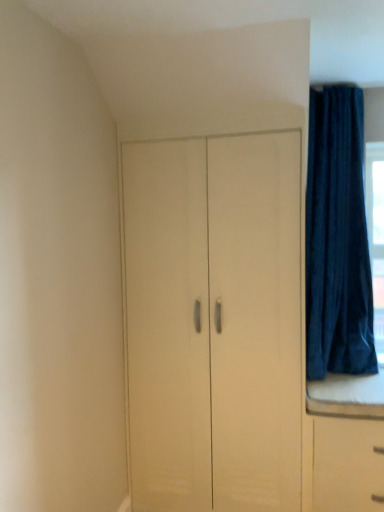
Question: From a real-world perspective, is matte white cupboard at center positioned above or below dark blue velvet curtain at upper right?

Choices:
 (A) below
 (B) above

Answer: (A)

Question: In terms of height, does matte white cupboard at center look taller or shorter compared to dark blue velvet curtain at upper right?

Choices:
 (A) short
 (B) tall

Answer: (B)

Question: From the image's perspective, relative to dark blue velvet curtain at upper right, is matte white cupboard at center above or below?

Choices:
 (A) above
 (B) below

Answer: (B)

Question: From a real-world perspective, relative to matte white cupboard at center, is dark blue velvet curtain at upper right vertically above or below?

Choices:
 (A) above
 (B) below

Answer: (A)

Question: Is dark blue velvet curtain at upper right wider or thinner than matte white cupboard at center?

Choices:
 (A) thin
 (B) wide

Answer: (B)

Question: Would you say dark blue velvet curtain at upper right is to the left or to the right of matte white cupboard at center in the picture?

Choices:
 (A) left
 (B) right

Answer: (B)

Question: Is point (306, 311) positioned closer to the camera than point (296, 264)?

Choices:
 (A) farther
 (B) closer

Answer: (A)